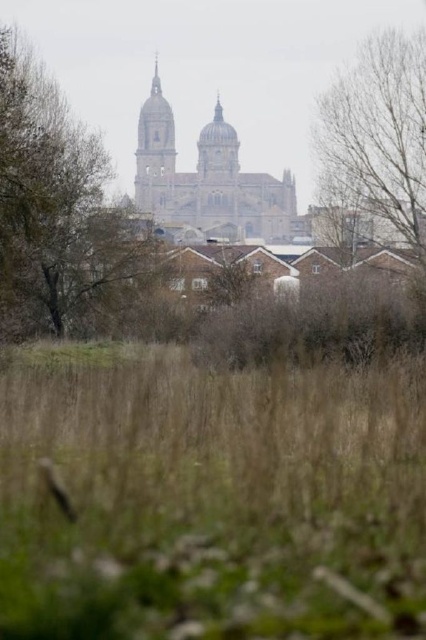
Which is more to the right, brown leafy tree at upper center or bare branches at upper center?

bare branches at upper center

Can you confirm if brown leafy tree at upper center is wider than bare branches at upper center?

Yes.

This screenshot has width=426, height=640. Describe the element at coordinates (60, 214) in the screenshot. I see `brown leafy tree at upper center` at that location.

This screenshot has width=426, height=640. Identify the location of brown leafy tree at upper center. coord(60,214).

Is brown grass at lower center shorter than bare branches at upper center?

Yes.

Does brown grass at lower center appear over bare branches at upper center?

No, brown grass at lower center is not above bare branches at upper center.

Is point (117, 408) positioned after point (367, 99)?

No, it is in front of (367, 99).

Find the location of a particular element. Image resolution: width=426 pixels, height=640 pixels. brown grass at lower center is located at coordinates (209, 497).

Between bare branches at upper center and brown stone tower at center, which one is positioned higher?

Positioned higher is brown stone tower at center.

Does bare branches at upper center appear on the left side of brown stone tower at center?

Incorrect, bare branches at upper center is not on the left side of brown stone tower at center.

Find the location of a particular element. The width and height of the screenshot is (426, 640). bare branches at upper center is located at coordinates (379, 138).

The width and height of the screenshot is (426, 640). Identify the location of bare branches at upper center. (379, 138).